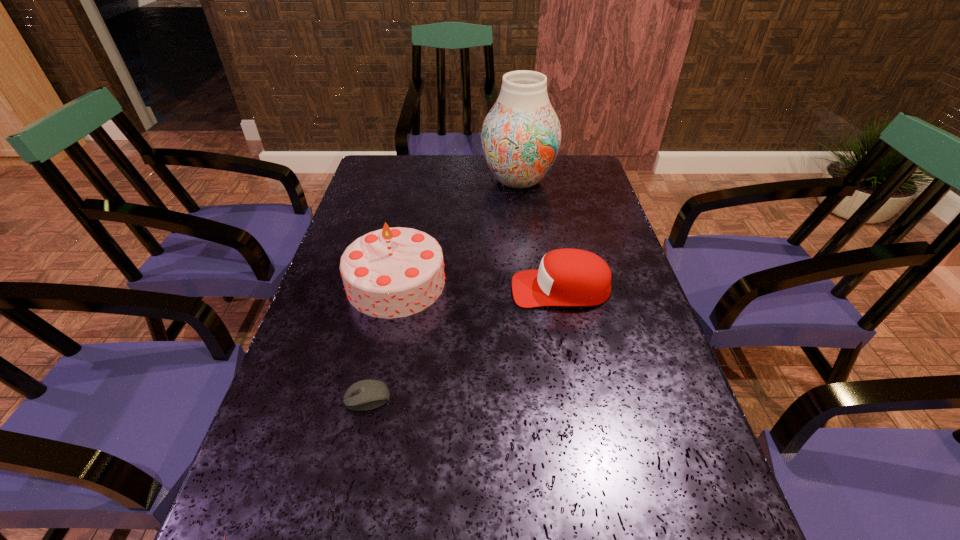
You are a GUI agent. You are given a task and a screenshot of the screen. Output one action in this format:
    pyautogui.click(x=<x>, y=<y>)
    Task: Click on the farthest object
    
    Given the screenshot: What is the action you would take?
    pyautogui.click(x=521, y=135)

Where is `the tallest object`? the tallest object is located at coordinates (521, 135).

The height and width of the screenshot is (540, 960). Find the location of `birthday cake`. birthday cake is located at coordinates (395, 272).

Locate an element on the screen. This screenshot has height=540, width=960. baseball cap is located at coordinates (566, 277).

Locate an element on the screen. the fourth farthest object is located at coordinates (368, 394).

Where is `the taller mouse`? The height and width of the screenshot is (540, 960). the taller mouse is located at coordinates (368, 394).

Identify the location of free region located on the left of the farthest object. (394, 181).

Locate an element on the screen. free space located 0.200m on the back of the second tallest object is located at coordinates (411, 210).

Locate an element on the screen. This screenshot has width=960, height=540. free space located 0.100m on the front-facing side of the baseball cap is located at coordinates (470, 289).

The width and height of the screenshot is (960, 540). I want to click on vacant space located 0.290m on the front-facing side of the baseball cap, so click(393, 289).